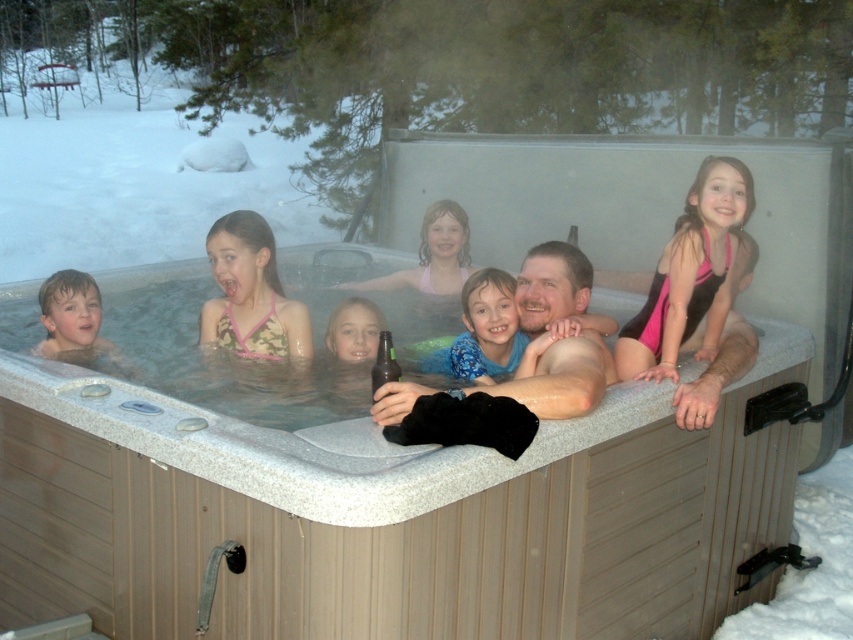
Which of these two, matte plastic hot tub at center or blue printed shirt at center, stands taller?

Standing taller between the two is matte plastic hot tub at center.

Is point (448, 218) positioned after point (498, 339)?

Yes, point (448, 218) is behind point (498, 339).

Locate an element on the screen. matte plastic hot tub at center is located at coordinates (715, 364).

Between smooth skin man at center and blue printed shirt at center, which one is positioned higher?

smooth skin man at center is higher up.

Is smooth skin man at center to the left of blue printed shirt at center from the viewer's perspective?

No, smooth skin man at center is not to the left of blue printed shirt at center.

Who is more forward, (577, 304) or (495, 282)?

Point (577, 304) is more forward.

Where is `smooth skin man at center`? smooth skin man at center is located at coordinates (563, 378).

Who is more forward, [223,224] or [485,307]?

Point [485,307] is in front.

Locate an element on the screen. This screenshot has width=853, height=640. camouflage swimsuit at center is located at coordinates (x=250, y=292).